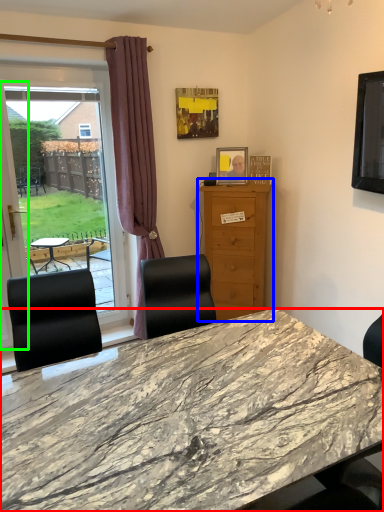
Question: Estimate the real-world distances between objects in this image. Which object is farther from desk (highlighted by a red box), cabinetry (highlighted by a blue box) or screen door (highlighted by a green box)?

Choices:
 (A) cabinetry
 (B) screen door

Answer: (B)